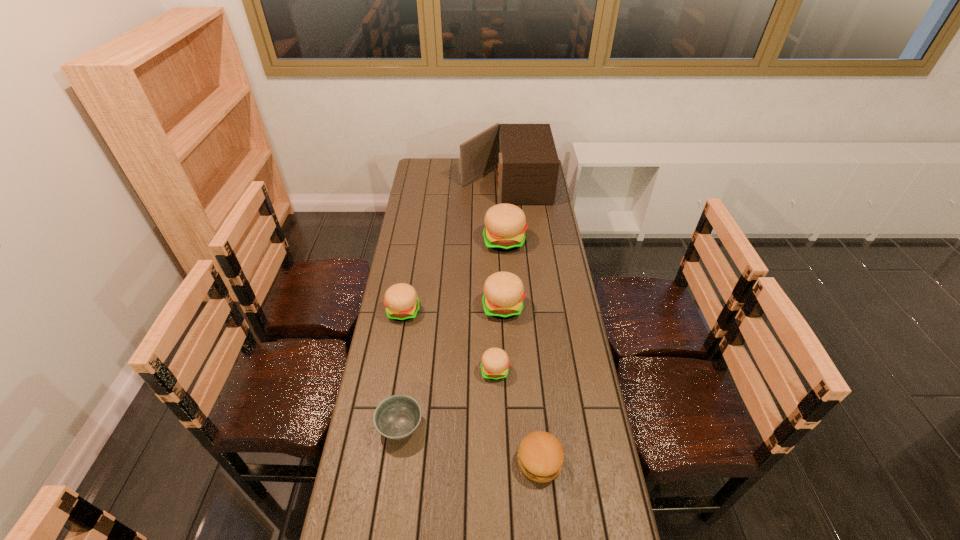
What are the coordinates of `free spot between the brown hamburger and the smallest beige hamburger` in the screenshot? It's located at click(517, 416).

Locate an element on the screen. The image size is (960, 540). empty space between the tallest hamburger and the shortest object is located at coordinates (452, 334).

Locate an element on the screen. Image resolution: width=960 pixels, height=540 pixels. vacant point located between the second smallest beige hamburger and the farthest beige hamburger is located at coordinates (454, 276).

Where is `free space that is in between the tallest object and the nearest hamburger`? This screenshot has width=960, height=540. free space that is in between the tallest object and the nearest hamburger is located at coordinates (522, 322).

The height and width of the screenshot is (540, 960). I want to click on empty location between the leftmost hamburger and the fourth farthest hamburger, so click(x=449, y=341).

Where is `object that ranks as the second closest to the fifth shortest object`? The height and width of the screenshot is (540, 960). object that ranks as the second closest to the fifth shortest object is located at coordinates (505, 224).

Choose which object is the sixth nearest neighbor to the nearest hamburger. Please provide its 2D coordinates. Your answer should be formatted as a tuple, i.e. [(x, y)], where the tuple contains the x and y coordinates of a point satisfying the conditions above.

[(528, 165)]

You are a GUI agent. You are given a task and a screenshot of the screen. Output one action in this format:
    pyautogui.click(x=<x>, y=<y>)
    Task: Click on the second closest hamburger relative to the gray bowl
    The height and width of the screenshot is (540, 960).
    Given the screenshot: What is the action you would take?
    pyautogui.click(x=540, y=456)

At what (x,y) coordinates should I click in order to perform the action: click on hamburger that is the fourth closest to the second nearest hamburger. Please return your answer as a coordinate pair (x, y). Looking at the image, I should click on (505, 224).

At what (x,y) coordinates should I click in order to perform the action: click on beige hamburger that stands as the closest to the microwave oven. Please return your answer as a coordinate pair (x, y). Looking at the image, I should click on (505, 224).